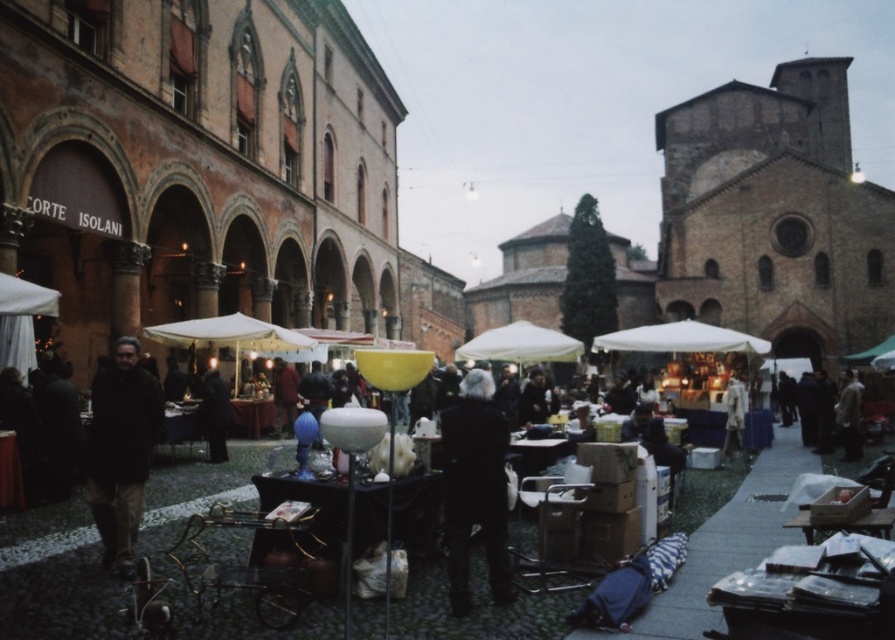
Who is more forward, (491,467) or (134,513)?

Point (134,513) is in front.

Does black wool coat at center have a greater height compared to dark brown leather jacket at left?

Yes, black wool coat at center is taller than dark brown leather jacket at left.

Is point (503, 544) in front of point (139, 512)?

That is False.

Identify the location of black wool coat at center. The width and height of the screenshot is (895, 640). (475, 488).